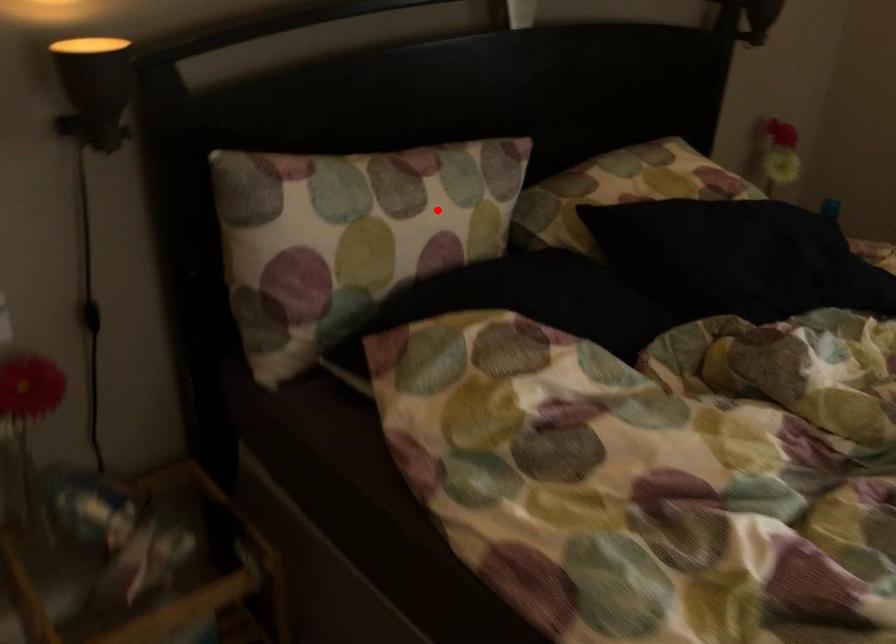
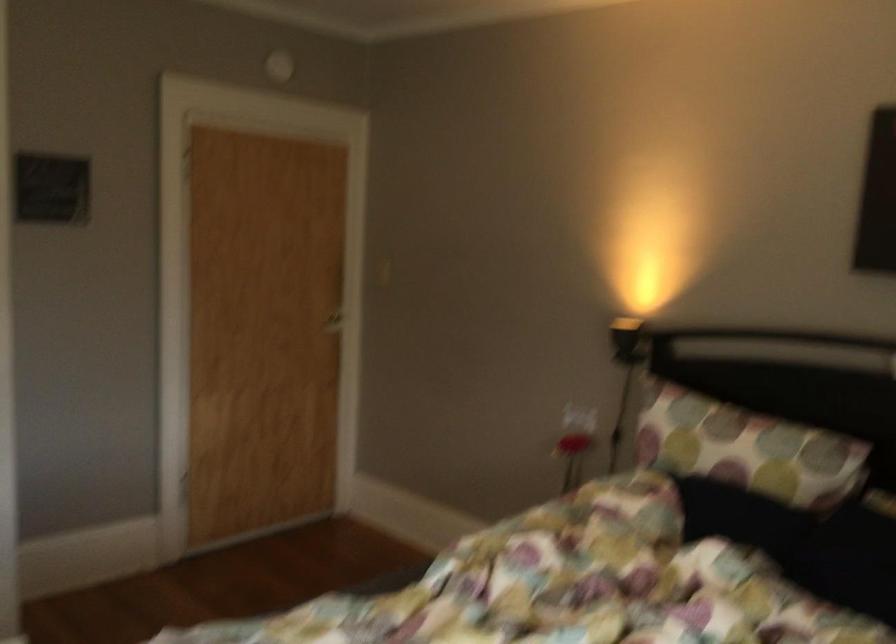
Where in the second image is the point corresponding to the highlighted location from the first image?

(746, 449)